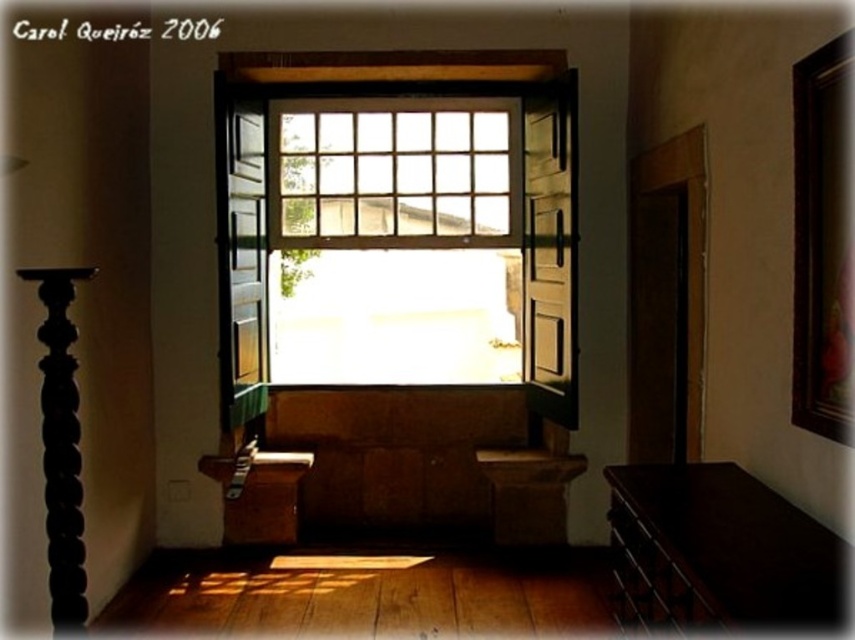
Question: Which point is closer to the camera taking this photo?

Choices:
 (A) (500, 477)
 (B) (640, 484)
 (C) (394, 289)
 (D) (80, 525)

Answer: (D)

Question: Which of the following is the closest to the observer?

Choices:
 (A) black wood pillar at left
 (B) dark wood balustrade at lower right
 (C) wooden bench at center

Answer: (B)

Question: Does dark wood balustrade at lower right have a lesser width compared to black wood pillar at left?

Choices:
 (A) yes
 (B) no

Answer: (B)

Question: Can you confirm if wooden at center is thinner than wooden bench at center?

Choices:
 (A) yes
 (B) no

Answer: (A)

Question: Which point is closer to the camera?

Choices:
 (A) black wood pillar at left
 (B) dark wood balustrade at lower right
 (C) wooden at center
 (D) wooden bench at center

Answer: (B)

Question: Observing the image, what is the correct spatial positioning of wooden at center in reference to wooden bench at center?

Choices:
 (A) below
 (B) above

Answer: (B)